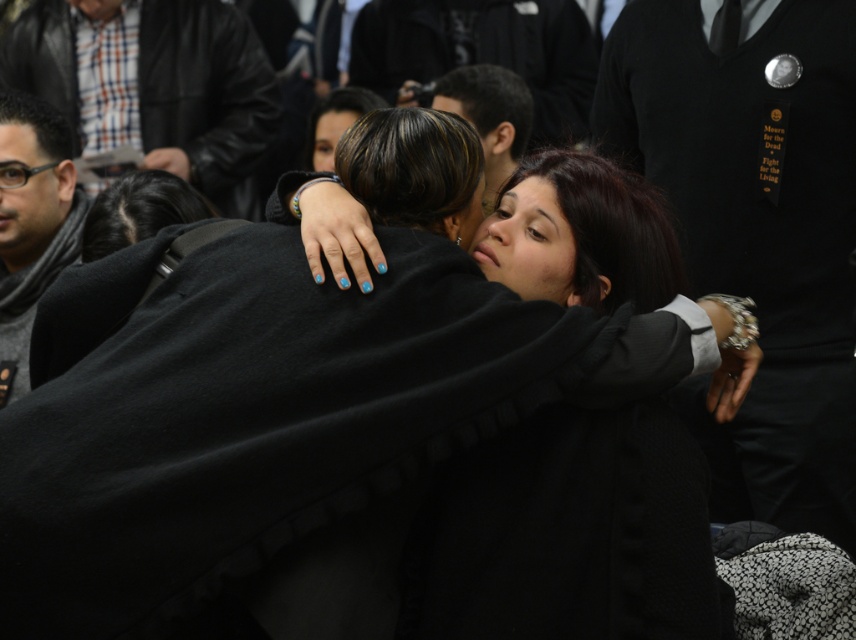
Who is more forward, (308, 353) or (494, 93)?

Point (308, 353) is in front.

Who is more forward, (201, 339) or (513, 144)?

Point (201, 339) is more forward.

The image size is (856, 640). In order to click on matte black coat at center in this screenshot , I will do `click(354, 444)`.

Is gray knit scarf at left wider than dark brown hair at center?

In fact, gray knit scarf at left might be narrower than dark brown hair at center.

Does point (4, 296) lie behind point (477, 129)?

No.

Who is more forward, (36, 268) or (403, 93)?

Point (36, 268)

In order to click on gray knit scarf at left in this screenshot , I will do `click(31, 224)`.

Which is in front, point (512, 456) or point (16, 273)?

Point (512, 456) is more forward.

Does matte black coat at center have a lesser height compared to gray knit scarf at left?

Correct, matte black coat at center is not as tall as gray knit scarf at left.

Measure the distance between matte black coat at center and camera.

matte black coat at center and camera are 5.74 feet apart from each other.

Where is `matte black coat at center`? matte black coat at center is located at coordinates (354, 444).